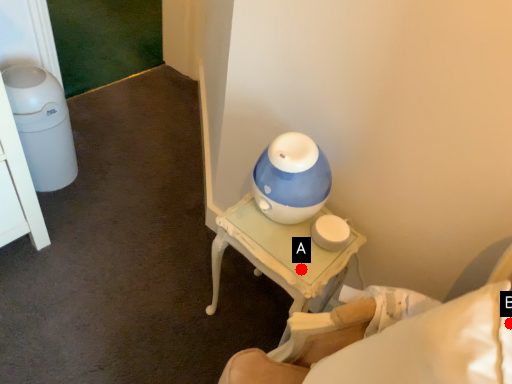
Question: Two points are circled on the image, labeled by A and B beside each circle. Which point is further to the camera?

Choices:
 (A) A is further
 (B) B is further

Answer: (A)